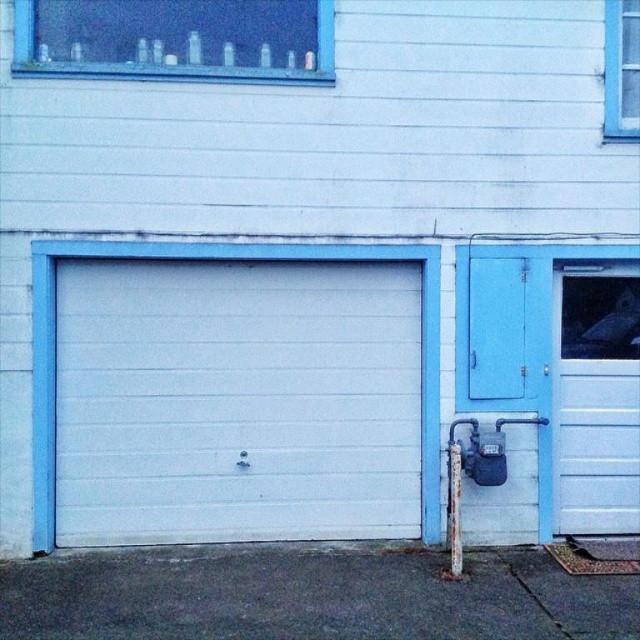
Question: Which object is closer to the camera taking this photo?

Choices:
 (A) white smooth garage door at center
 (B) white plastic pole at lower center
 (C) white matte door at right

Answer: (B)

Question: Does matte blue door at right have a greater width compared to transparent glass bottles at upper center?

Choices:
 (A) no
 (B) yes

Answer: (A)

Question: Which object is closer to the camera taking this photo?

Choices:
 (A) matte blue door at right
 (B) white smooth garage door at center
 (C) white matte door at right

Answer: (B)

Question: Considering the real-world distances, which object is farthest from the matte blue door at right?

Choices:
 (A) white smooth garage door at center
 (B) transparent glass bottles at upper center
 (C) white plastic pole at lower center
 (D) white matte door at right

Answer: (B)

Question: Can you confirm if white smooth garage door at center is positioned to the right of white plastic pole at lower center?

Choices:
 (A) yes
 (B) no

Answer: (B)

Question: Is white matte door at right to the left of white smooth garage door at center from the viewer's perspective?

Choices:
 (A) yes
 (B) no

Answer: (B)